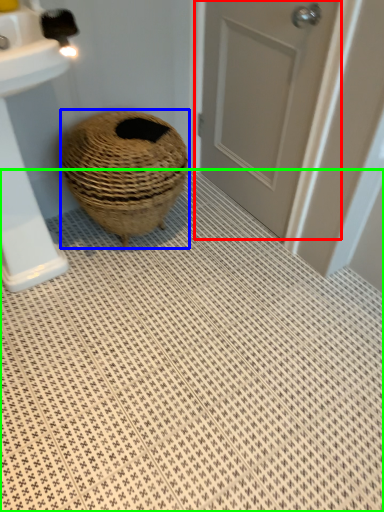
Question: Considering the real-world distances, which object is farthest from door (highlighted by a red box)? basket (highlighted by a blue box) or bath mat (highlighted by a green box)?

Choices:
 (A) basket
 (B) bath mat

Answer: (B)